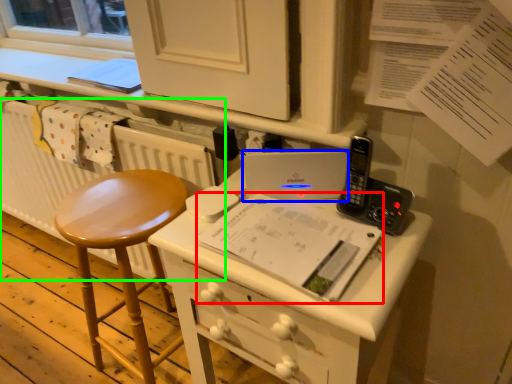
Question: Considering the real-world distances, which object is closest to book (highlighted by a red box)? laptop (highlighted by a blue box) or radiator (highlighted by a green box).

Choices:
 (A) laptop
 (B) radiator

Answer: (A)